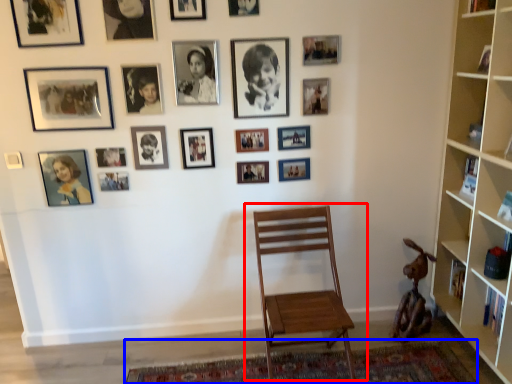
Question: Which object is further to the camera taking this photo, chair (highlighted by a red box) or mat (highlighted by a blue box)?

Choices:
 (A) chair
 (B) mat

Answer: (B)